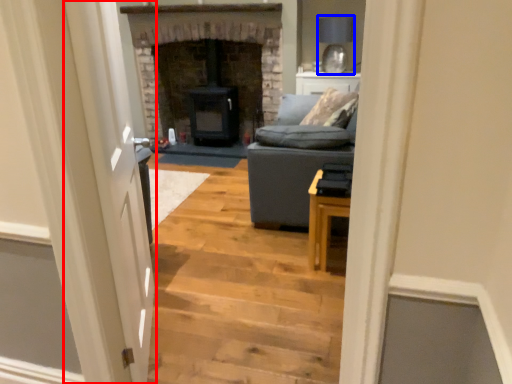
Question: Among these objects, which one is farthest to the camera, glass door (highlighted by a red box) or lamp (highlighted by a blue box)?

Choices:
 (A) glass door
 (B) lamp

Answer: (B)